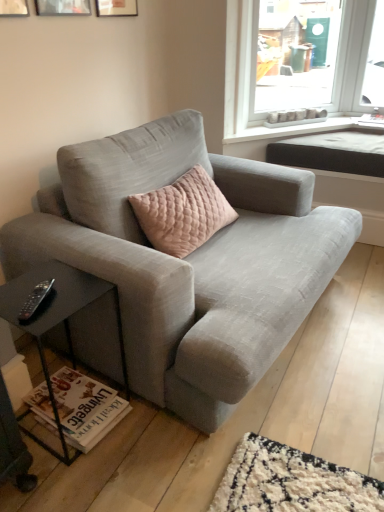
The image size is (384, 512). Find the location of `space that is in front of black matte side table at lower left`. space that is in front of black matte side table at lower left is located at coordinates (77, 478).